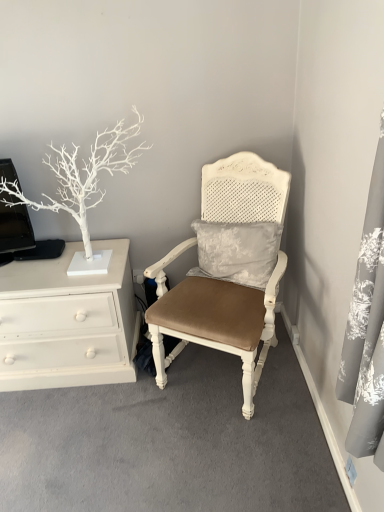
Question: Should I look upward or downward to see matte white chair at center?

Choices:
 (A) up
 (B) down

Answer: (B)

Question: From a real-world perspective, is matte white chair at center on white painted wood chest of drawers at left?

Choices:
 (A) yes
 (B) no

Answer: (A)

Question: Can you confirm if matte white chair at center is positioned to the left of white painted wood chest of drawers at left?

Choices:
 (A) yes
 (B) no

Answer: (B)

Question: Is matte white chair at center further to camera compared to white painted wood chest of drawers at left?

Choices:
 (A) no
 (B) yes

Answer: (A)

Question: Is matte white chair at center wider than white painted wood chest of drawers at left?

Choices:
 (A) yes
 (B) no

Answer: (A)

Question: Is matte white chair at center next to white painted wood chest of drawers at left?

Choices:
 (A) yes
 (B) no

Answer: (B)

Question: Is matte white chair at center not inside white painted wood chest of drawers at left?

Choices:
 (A) no
 (B) yes

Answer: (B)

Question: From a real-world perspective, does white painted wood chest of drawers at left stand above matte white chair at center?

Choices:
 (A) no
 (B) yes

Answer: (A)

Question: From the image's perspective, would you say white painted wood chest of drawers at left is positioned over matte white chair at center?

Choices:
 (A) yes
 (B) no

Answer: (B)

Question: Can you confirm if white painted wood chest of drawers at left is bigger than matte white chair at center?

Choices:
 (A) yes
 (B) no

Answer: (B)

Question: Can you confirm if white painted wood chest of drawers at left is thinner than matte white chair at center?

Choices:
 (A) yes
 (B) no

Answer: (A)

Question: Would you say white painted wood chest of drawers at left is a long distance from matte white chair at center?

Choices:
 (A) no
 (B) yes

Answer: (A)

Question: Considering the relative sizes of white painted wood chest of drawers at left and matte white chair at center in the image provided, is white painted wood chest of drawers at left shorter than matte white chair at center?

Choices:
 (A) yes
 (B) no

Answer: (A)

Question: Is white matte tree at left not inside white painted wood chest of drawers at left?

Choices:
 (A) yes
 (B) no

Answer: (A)